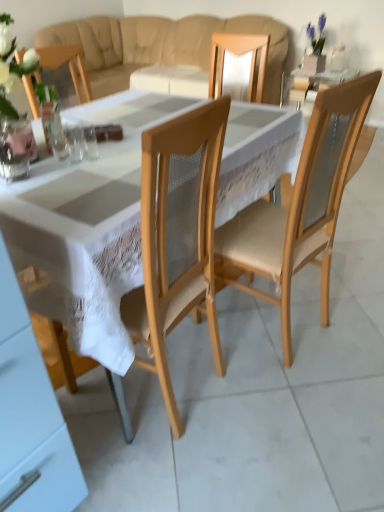
At what (x,y) coordinates should I click in order to perform the action: click on free space to the right of white glossy cabinet at lower left. Please return your answer as a coordinate pair (x, y). This screenshot has height=512, width=384. Looking at the image, I should click on (144, 482).